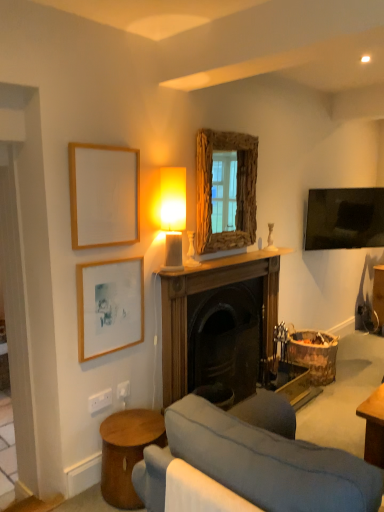
Question: Can you confirm if wooden fireplace at center is taller than rustic wood mirror at upper center?

Choices:
 (A) yes
 (B) no

Answer: (A)

Question: Can you confirm if wooden fireplace at center is thinner than rustic wood mirror at upper center?

Choices:
 (A) no
 (B) yes

Answer: (A)

Question: From the image's perspective, is wooden fireplace at center above rustic wood mirror at upper center?

Choices:
 (A) no
 (B) yes

Answer: (A)

Question: Would you say wooden fireplace at center is outside rustic wood mirror at upper center?

Choices:
 (A) no
 (B) yes

Answer: (B)

Question: From a real-world perspective, is wooden fireplace at center positioned under rustic wood mirror at upper center based on gravity?

Choices:
 (A) yes
 (B) no

Answer: (A)

Question: Is wooden fireplace at center not near rustic wood mirror at upper center?

Choices:
 (A) yes
 (B) no

Answer: (B)

Question: Is wooden picture frame at lower left, positioned as the 1th picture frame in bottom-to-top order, oriented towards matte wooden picture frame at upper left, which is the 1th picture frame from top to bottom?

Choices:
 (A) no
 (B) yes

Answer: (A)

Question: Considering the relative positions of wooden picture frame at lower left, which ranks as the 2th picture frame in top-to-bottom order, and matte wooden picture frame at upper left, the second picture frame positioned from the bottom, in the image provided, is wooden picture frame at lower left, which ranks as the 2th picture frame in top-to-bottom order, to the right of matte wooden picture frame at upper left, the second picture frame positioned from the bottom, from the viewer's perspective?

Choices:
 (A) no
 (B) yes

Answer: (B)

Question: Is the depth of wooden picture frame at lower left, which ranks as the 2th picture frame in top-to-bottom order, less than that of matte wooden picture frame at upper left, the second picture frame positioned from the bottom?

Choices:
 (A) yes
 (B) no

Answer: (B)

Question: From the image's perspective, is wooden picture frame at lower left, which ranks as the 2th picture frame in top-to-bottom order, located beneath matte wooden picture frame at upper left, which is the 1th picture frame from top to bottom?

Choices:
 (A) no
 (B) yes

Answer: (B)

Question: From the image's perspective, does wooden picture frame at lower left, positioned as the 1th picture frame in bottom-to-top order, appear higher than matte wooden picture frame at upper left, the second picture frame positioned from the bottom?

Choices:
 (A) yes
 (B) no

Answer: (B)

Question: Can you confirm if wooden picture frame at lower left, positioned as the 1th picture frame in bottom-to-top order, is positioned to the left of matte wooden picture frame at upper left, which is the 1th picture frame from top to bottom?

Choices:
 (A) yes
 (B) no

Answer: (B)

Question: Is velvet grey couch at lower center to the left of rustic wood mirror at upper center from the viewer's perspective?

Choices:
 (A) yes
 (B) no

Answer: (B)